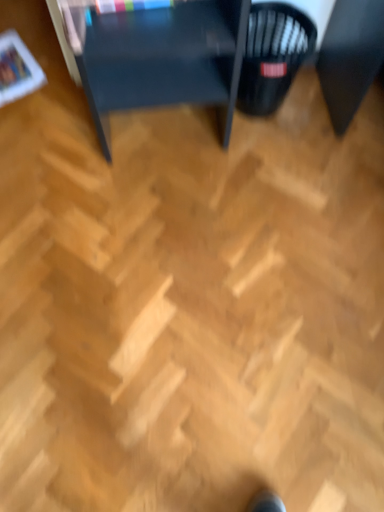
Question: Is matte black table at upper center inside the boundaries of black plastic basket at center right, or outside?

Choices:
 (A) inside
 (B) outside

Answer: (B)

Question: From a real-world perspective, is matte black table at upper center positioned above or below black plastic basket at center right?

Choices:
 (A) above
 (B) below

Answer: (A)

Question: In the image, is matte black table at upper center on the left side or the right side of black plastic basket at center right?

Choices:
 (A) right
 (B) left

Answer: (B)

Question: Which is correct: black plastic basket at center right is inside matte black table at upper center, or outside of it?

Choices:
 (A) inside
 (B) outside

Answer: (A)

Question: From the image's perspective, is black plastic basket at center right positioned above or below matte black table at upper center?

Choices:
 (A) below
 (B) above

Answer: (A)

Question: Is point (246, 58) positioned closer to the camera than point (117, 44)?

Choices:
 (A) closer
 (B) farther

Answer: (B)

Question: Considering the relative positions of black plastic basket at center right and matte black table at upper center in the image provided, is black plastic basket at center right to the left or to the right of matte black table at upper center?

Choices:
 (A) right
 (B) left

Answer: (A)